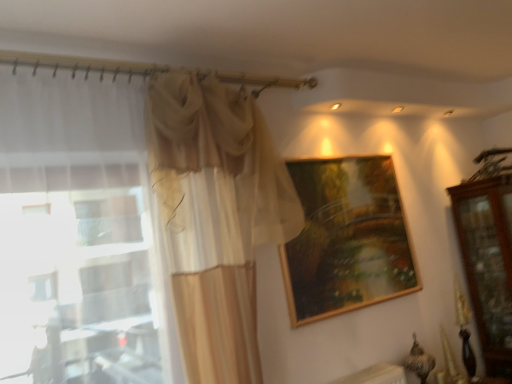
Question: From a real-world perspective, is mahogany wooden dresser at right physically above wooden frame at upper center?

Choices:
 (A) yes
 (B) no

Answer: (B)

Question: Does mahogany wooden dresser at right have a smaller size compared to wooden frame at upper center?

Choices:
 (A) no
 (B) yes

Answer: (A)

Question: Can wooden frame at upper center be found inside mahogany wooden dresser at right?

Choices:
 (A) no
 (B) yes

Answer: (A)

Question: Does mahogany wooden dresser at right have a greater height compared to wooden frame at upper center?

Choices:
 (A) no
 (B) yes

Answer: (B)

Question: Does mahogany wooden dresser at right come in front of wooden frame at upper center?

Choices:
 (A) no
 (B) yes

Answer: (A)

Question: From the image's perspective, is sheer beige curtain at left positioned above or below wooden frame at upper center?

Choices:
 (A) above
 (B) below

Answer: (A)

Question: Is sheer beige curtain at left bigger or smaller than wooden frame at upper center?

Choices:
 (A) big
 (B) small

Answer: (A)

Question: From their relative heights in the image, would you say sheer beige curtain at left is taller or shorter than wooden frame at upper center?

Choices:
 (A) short
 (B) tall

Answer: (B)

Question: Is point (124, 117) closer or farther from the camera than point (402, 230)?

Choices:
 (A) farther
 (B) closer

Answer: (B)

Question: In terms of height, does wooden frame at upper center look taller or shorter compared to sheer beige curtain at left?

Choices:
 (A) tall
 (B) short

Answer: (B)

Question: From a real-world perspective, is wooden frame at upper center physically located above or below sheer beige curtain at left?

Choices:
 (A) above
 (B) below

Answer: (B)

Question: Is wooden frame at upper center in front of or behind sheer beige curtain at left in the image?

Choices:
 (A) front
 (B) behind

Answer: (B)

Question: In terms of width, does wooden frame at upper center look wider or thinner when compared to sheer beige curtain at left?

Choices:
 (A) thin
 (B) wide

Answer: (A)

Question: Considering the positions of mahogany wooden dresser at right and sheer beige curtain at left in the image, is mahogany wooden dresser at right bigger or smaller than sheer beige curtain at left?

Choices:
 (A) small
 (B) big

Answer: (A)

Question: From the image's perspective, relative to sheer beige curtain at left, is mahogany wooden dresser at right above or below?

Choices:
 (A) above
 (B) below

Answer: (B)